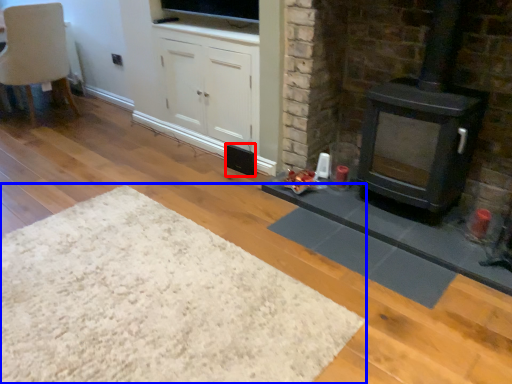
Question: Which object appears closest to the camera in this image, speaker (highlighted by a red box) or plain (highlighted by a blue box)?

Choices:
 (A) speaker
 (B) plain

Answer: (B)